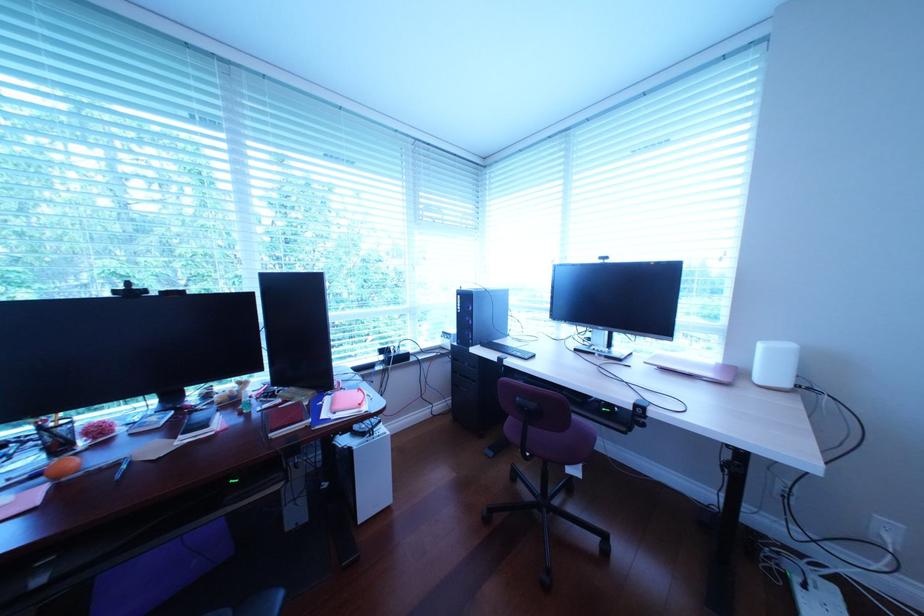
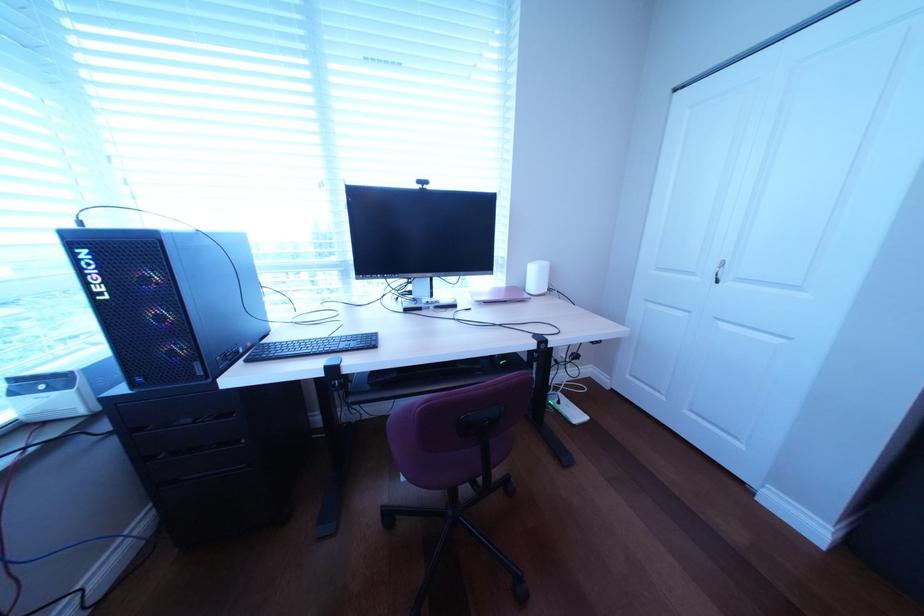
Question: Based on the continuous images, in which direction is the camera rotating? Reply with the corresponding letter.

Choices:
 (A) Left
 (B) Right
 (C) Up
 (D) Down

Answer: (B)